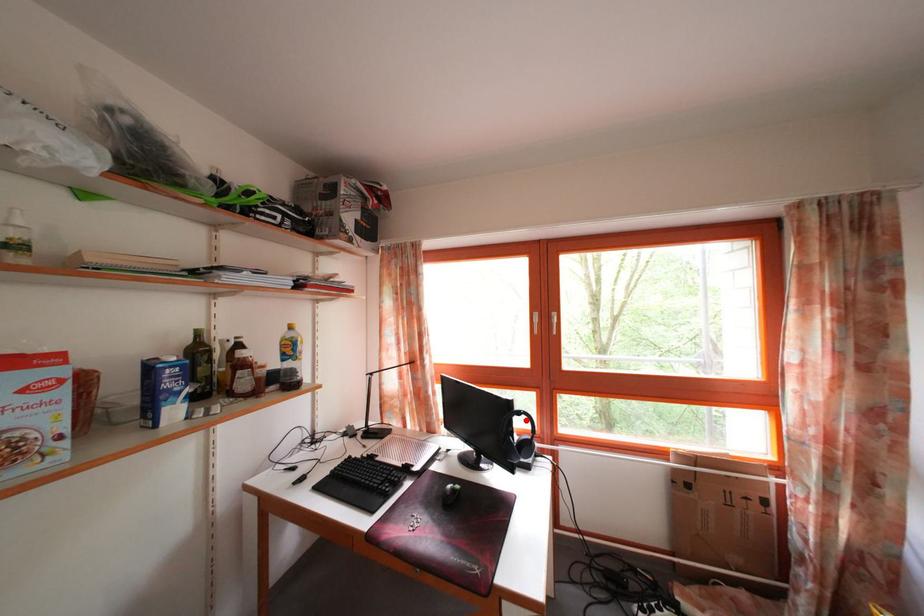
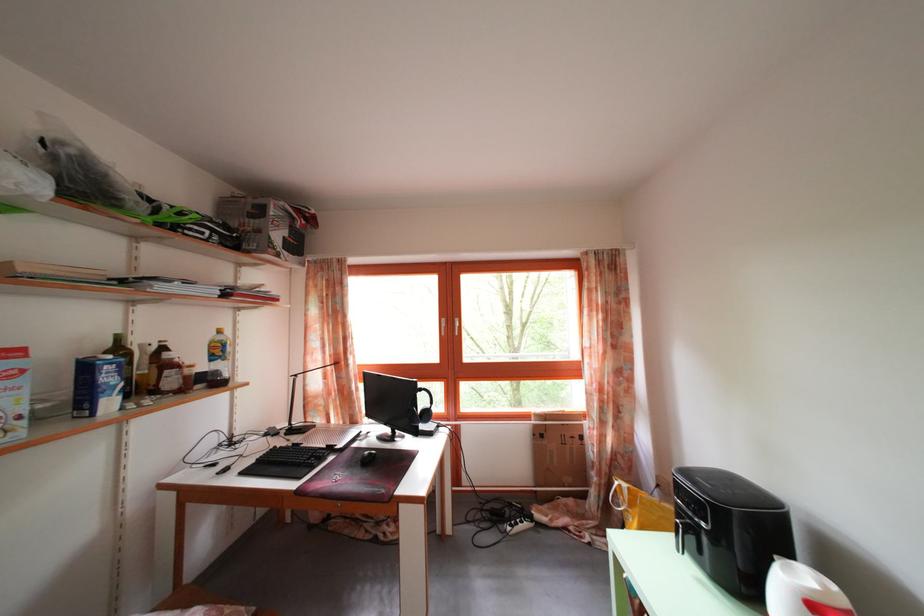
Where in the second image is the point corresponding to the highlighted location from the first image?

(428, 397)